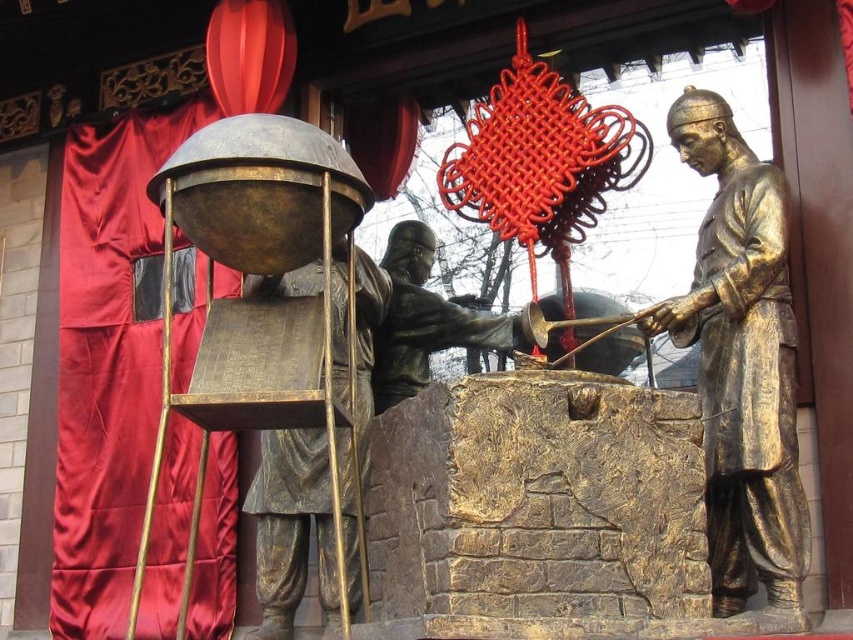
Who is taller, bronze statue at right or bronze statue at center?

bronze statue at right

Is bronze statue at right shorter than bronze statue at center?

No.

Which is in front, point (786, 595) or point (410, 342)?

Positioned in front is point (786, 595).

In order to click on bronze statue at right in this screenshot , I will do `click(741, 364)`.

Between satin red curtain at left and bronze statue of person at center, which one has more height?

With more height is satin red curtain at left.

Who is more forward, (206, 604) or (343, 536)?

Point (343, 536) is in front.

Based on the photo, who is more distant from viewer, (x=83, y=620) or (x=277, y=541)?

The point (x=83, y=620) is more distant.

This screenshot has width=853, height=640. What are the coordinates of `satin red curtain at left` in the screenshot? It's located at (108, 362).

Is point (306, 499) positioned before point (428, 298)?

Yes.

Looking at this image, can you confirm if bronze statue of person at center is smaller than bronze statue at center?

No.

The width and height of the screenshot is (853, 640). I want to click on bronze statue of person at center, so point(291,525).